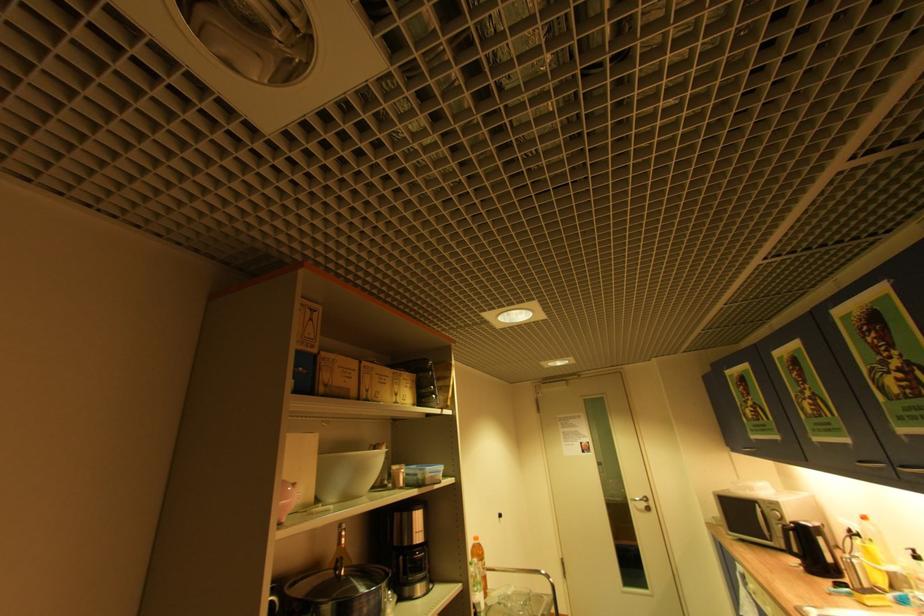
This screenshot has height=616, width=924. Describe the element at coordinates (640, 503) in the screenshot. I see `the silver door handle` at that location.